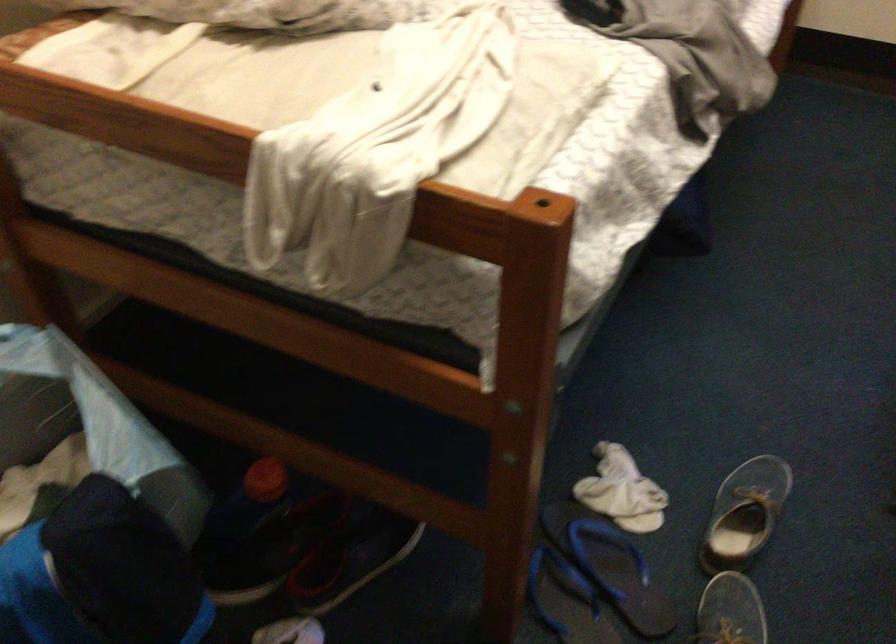
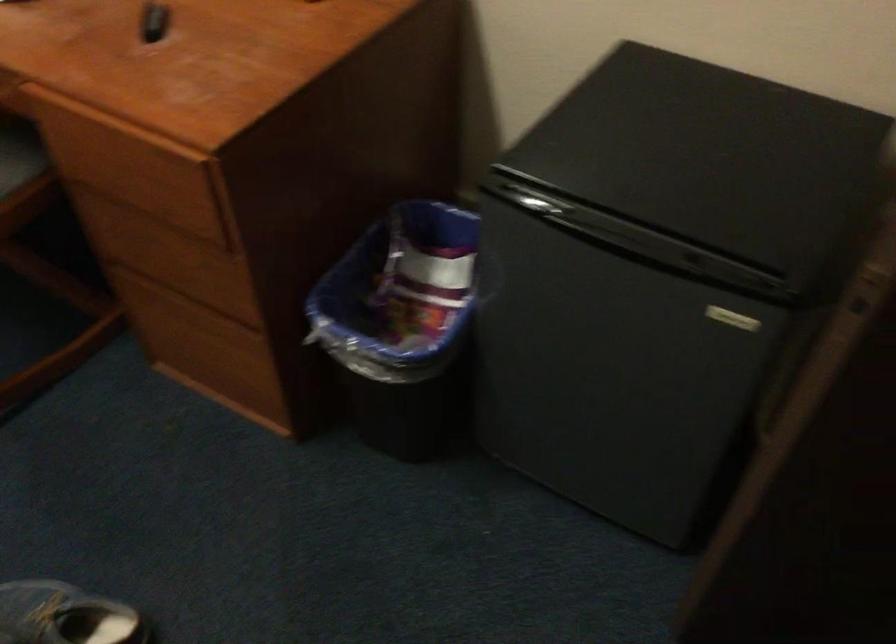
Based on the continuous images, in which direction is the camera rotating?

The camera rotated toward right-down.